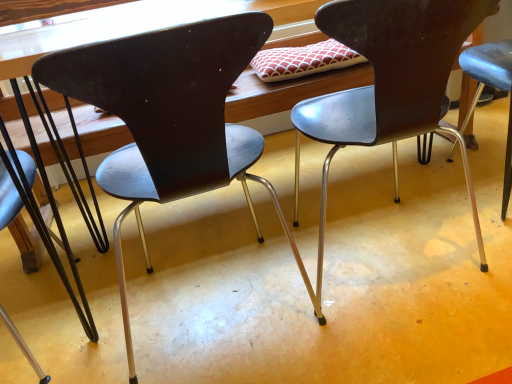
Question: Does point (150, 140) appear closer or farther from the camera than point (346, 135)?

Choices:
 (A) closer
 (B) farther

Answer: (A)

Question: Is matte black chair at center, the second chair viewed from the right, to the left or to the right of metallic black chair at center, acting as the 1th chair starting from the right, in the image?

Choices:
 (A) left
 (B) right

Answer: (A)

Question: Which of these objects is positioned farthest from the matte black chair at center, the second chair viewed from the right?

Choices:
 (A) metallic black chair at center, which is the 3th chair from left to right
 (B) metallic dark brown chair at left, which is the 1th chair in left-to-right order

Answer: (B)

Question: Which object is positioned closest to the metallic black chair at center, which is the 3th chair from left to right?

Choices:
 (A) metallic dark brown chair at left, the 3th chair in the right-to-left sequence
 (B) matte black chair at center, the second chair positioned from the left

Answer: (B)